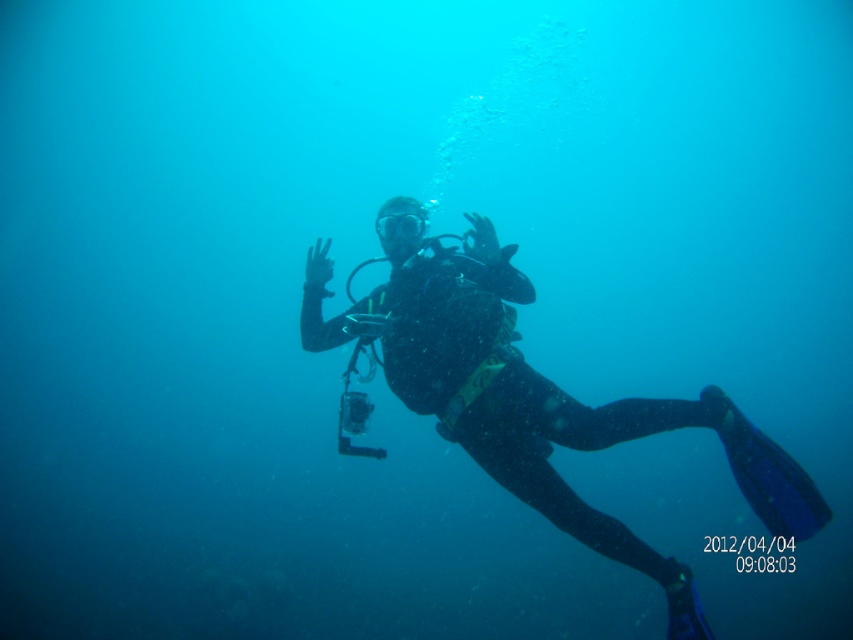
You are an underwater photographer aiming to capture the scuba diver in the image. You want to position your camera so that the black matte wetsuit at center and transparent rubber goggles at center are both clearly visible. Based on their positions, which object should appear higher in the photo?

The transparent rubber goggles at center should appear higher in the photo because the black matte wetsuit at center is located below it.

You are an underwater photographer aiming to capture the scuba diver in the image. Since you need to focus on the black matte wetsuit at center and transparent rubber goggles at center, which object should you adjust your camera settings for a wider aperture to ensure both are in focus?

The black matte wetsuit at center has a larger width than the transparent rubber goggles at center, so adjusting the camera settings for a wider aperture will help ensure both the wider black matte wetsuit at center and the smaller transparent rubber goggles at center are in focus.

You are an underwater photographer aiming to capture the scuba diver in the center. Where should you position your camera to focus on the black matte wetsuit at center?

The black matte wetsuit at center is located at point (523, 403), so you should position your camera to focus on that coordinate to capture the scuba diver in the center.